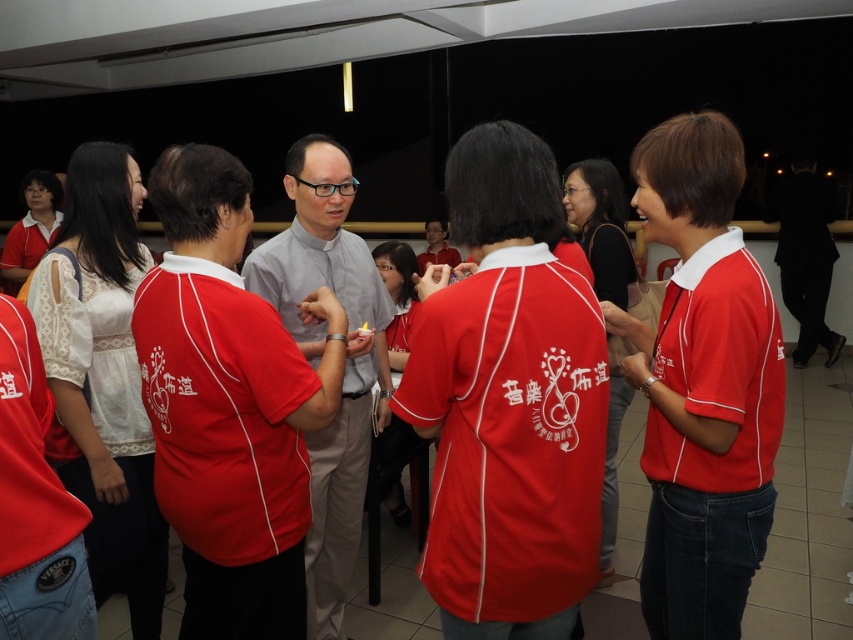
You are standing in the room and want to take a photo of both point (242,563) and point (328,614). Which point should you focus on first to ensure both are in focus?

You should focus on point (242,563) first because it is closer to the camera than point (328,614).

You are organizing a photo shoot and need to arrange the light gray fabric shirt at center and the light gray shirt at center in a way that highlights their size difference. Which object should be placed in the foreground to make the size difference more apparent?

The light gray fabric shirt at center is smaller than the light gray shirt at center, so placing the smaller light gray fabric shirt at center in the foreground will make the size difference more apparent.

You are standing in the front row of the indoor event and want to hand a gift to the person wearing the light gray fabric shirt at center. However, there is another person wearing a light gray shirt at center. Which one is closer to you?

The light gray fabric shirt at center is closer to the viewer than the light gray shirt at center, so you should hand the gift to the light gray fabric shirt at center.